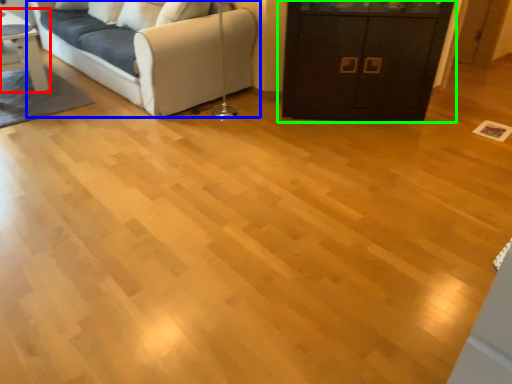
Question: Which is nearer to the table (highlighted by a red box)? studio couch (highlighted by a blue box) or cabinetry (highlighted by a green box).

Choices:
 (A) studio couch
 (B) cabinetry

Answer: (A)